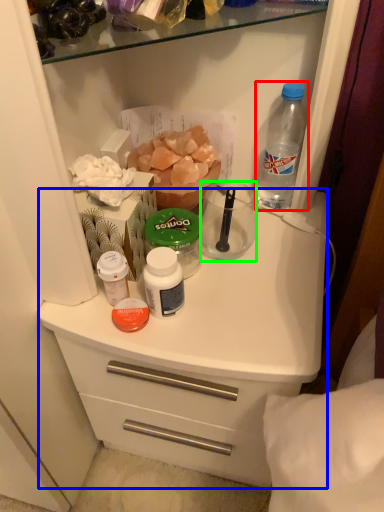
Question: Which is farther away from bottle (highlighted by a red box)? counter (highlighted by a blue box) or coffee cup (highlighted by a green box)?

Choices:
 (A) counter
 (B) coffee cup

Answer: (A)